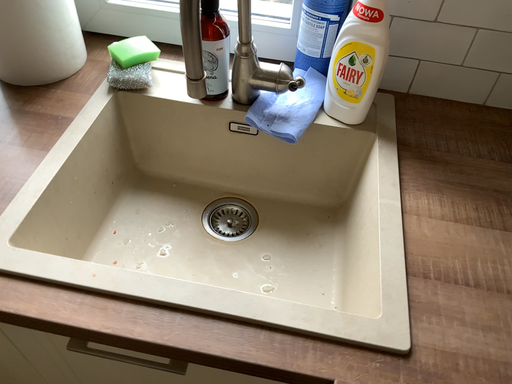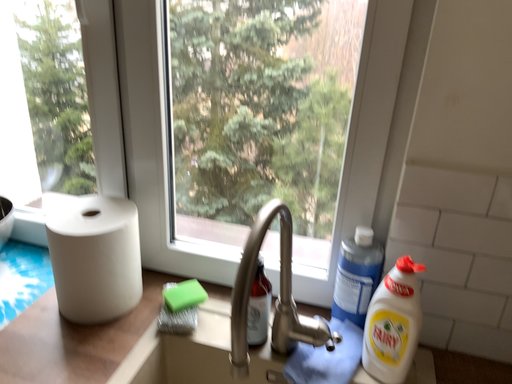
Question: How did the camera likely rotate when shooting the video?

Choices:
 (A) rotated upward
 (B) rotated downward

Answer: (A)